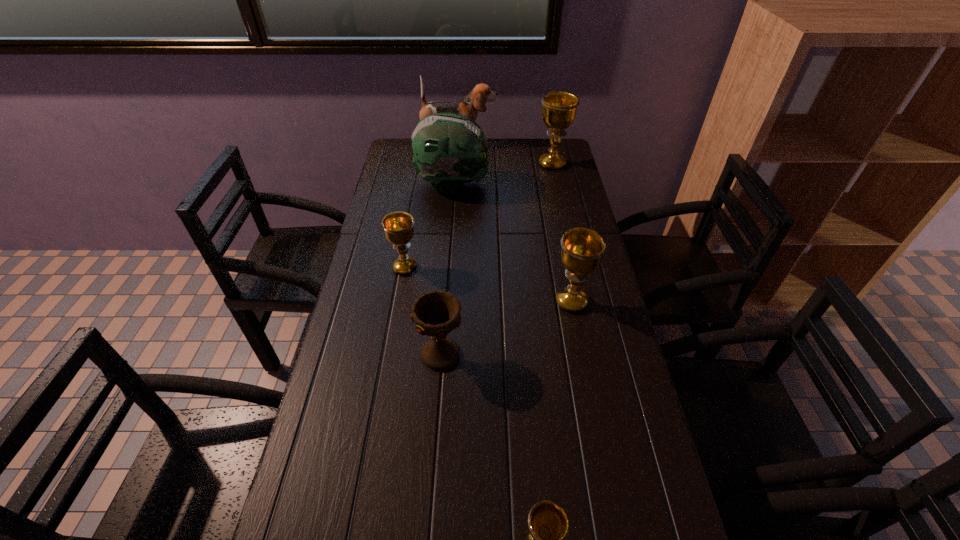
Identify the location of the leftmost gold chalice. (398, 227).

Image resolution: width=960 pixels, height=540 pixels. Identify the location of free spot located 0.070m at the face of the puppy. (513, 144).

I want to click on vacant space positioned on the front of the farthest gold chalice, so click(x=557, y=186).

Where is `free spot located 0.300m on the visor of the green football helmet`? This screenshot has width=960, height=540. free spot located 0.300m on the visor of the green football helmet is located at coordinates (568, 185).

In order to click on free region located 0.290m on the left of the fourth shortest object in this screenshot , I will do `click(449, 302)`.

Where is `free space located 0.260m on the back of the fourth farthest chalice`? The image size is (960, 540). free space located 0.260m on the back of the fourth farthest chalice is located at coordinates (447, 268).

You are a GUI agent. You are given a task and a screenshot of the screen. Output one action in this format:
    pyautogui.click(x=<x>, y=<y>)
    Task: Click on the vacant space situated on the back of the third nearest gold chalice
    Image resolution: width=960 pixels, height=540 pixels.
    Given the screenshot: What is the action you would take?
    pyautogui.click(x=417, y=198)

At what (x,y) coordinates should I click in order to perform the action: click on puppy that is at the far edge. Please return your answer as a coordinate pair (x, y). The image size is (960, 540). Looking at the image, I should click on (469, 106).

At what (x,y) coordinates should I click in order to perform the action: click on chalice situated at the far edge. Please return your answer as a coordinate pair (x, y). Looking at the image, I should click on (559, 108).

Where is `puppy present at the left edge`? The width and height of the screenshot is (960, 540). puppy present at the left edge is located at coordinates (469, 106).